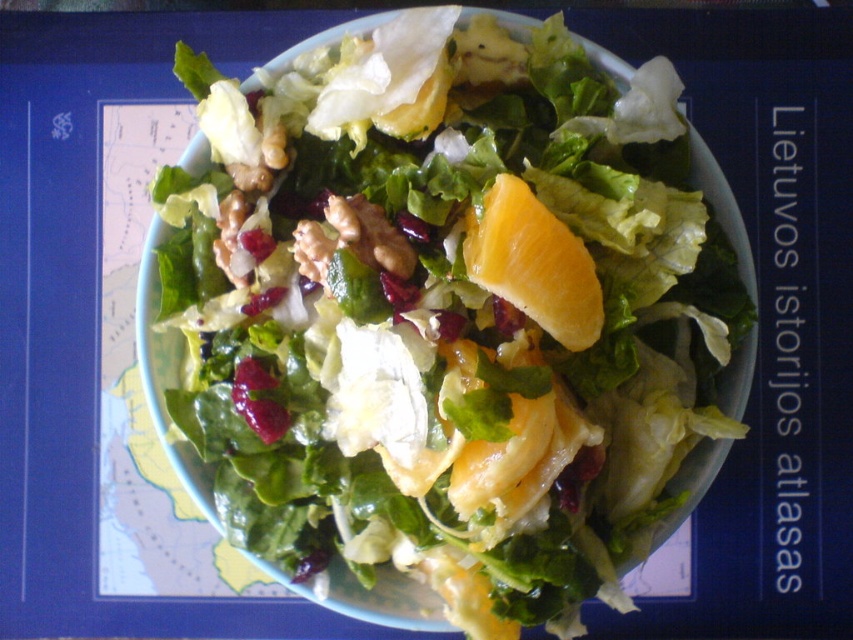
Looking at this image, can you confirm if green leafy salad at center is thinner than orangesmoothfruit at center?

Incorrect, green leafy salad at center's width is not less than orangesmoothfruit at center's.

Is point (445, 435) closer to camera compared to point (511, 218)?

No, (445, 435) is behind (511, 218).

Where is `green leafy salad at center`? Image resolution: width=853 pixels, height=640 pixels. green leafy salad at center is located at coordinates (444, 317).